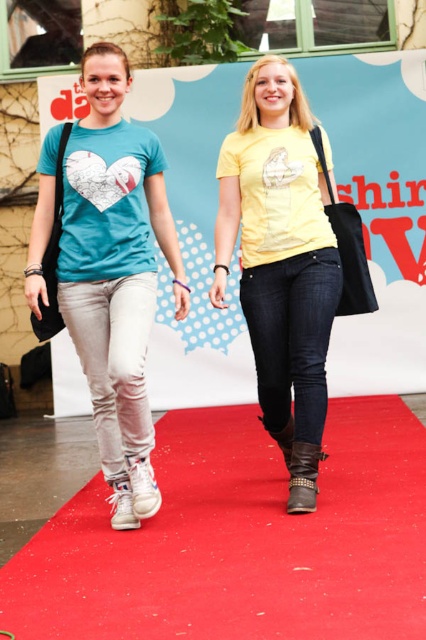
You are a photographer at an event and need to capture a closeup of the white suede boot at lower left without the red carpet at center showing in the frame. Is the boot small enough to fit entirely within the camera frame without the carpet being visible?

The red carpet at center has a larger size compared to white suede boot at lower left. Since the boot is smaller, it can be framed in such a way that the carpet is excluded from the shot.